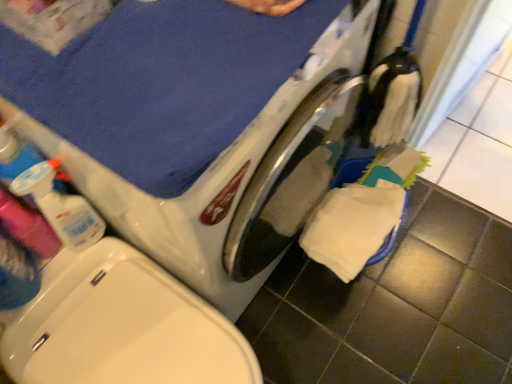
Question: From the image's perspective, relative to translucent plastic spray bottle at left, is polished stainless steel washing machine at center above or below?

Choices:
 (A) below
 (B) above

Answer: (B)

Question: Would you say polished stainless steel washing machine at center is to the left or to the right of translucent plastic spray bottle at left in the picture?

Choices:
 (A) right
 (B) left

Answer: (A)

Question: Is polished stainless steel washing machine at center in front of or behind translucent plastic spray bottle at left in the image?

Choices:
 (A) front
 (B) behind

Answer: (A)

Question: In the image, is translucent plastic spray bottle at left positioned in front of or behind polished stainless steel washing machine at center?

Choices:
 (A) front
 (B) behind

Answer: (B)

Question: Considering the positions of translucent plastic spray bottle at left and polished stainless steel washing machine at center in the image, is translucent plastic spray bottle at left taller or shorter than polished stainless steel washing machine at center?

Choices:
 (A) short
 (B) tall

Answer: (A)

Question: Is translucent plastic spray bottle at left bigger or smaller than polished stainless steel washing machine at center?

Choices:
 (A) small
 (B) big

Answer: (A)

Question: Would you say translucent plastic spray bottle at left is to the left or to the right of polished stainless steel washing machine at center in the picture?

Choices:
 (A) left
 (B) right

Answer: (A)